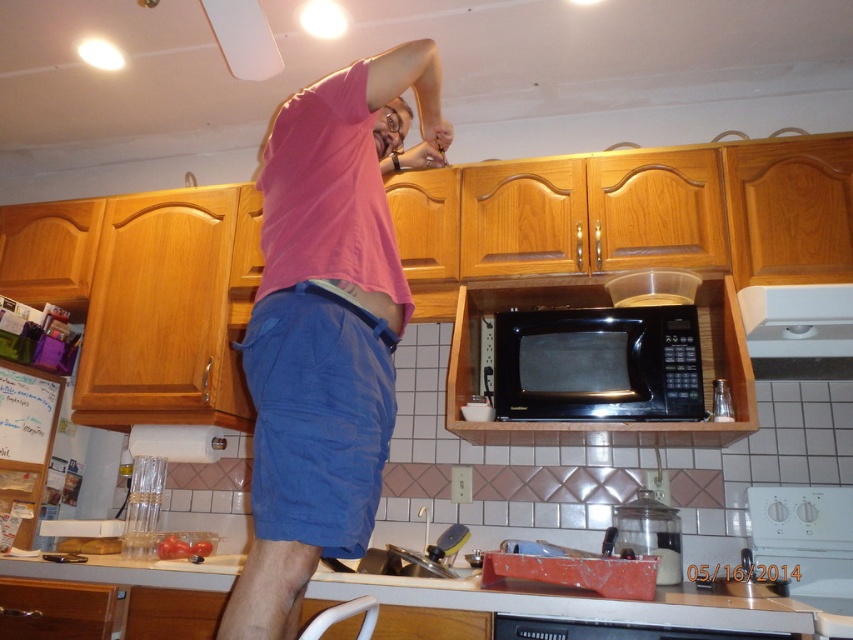
Question: Estimate the real-world distances between objects in this image. Which object is farther from the black matte microwave at center?

Choices:
 (A) pink cotton shirt at upper center
 (B) white plastic exhaust hood at upper right

Answer: (A)

Question: Observing the image, what is the correct spatial positioning of white glossy countertop at lower center in reference to white plastic exhaust hood at upper right?

Choices:
 (A) right
 (B) left

Answer: (B)

Question: Which point is farther to the camera?

Choices:
 (A) white plastic exhaust hood at upper right
 (B) black matte microwave at center
 (C) white glossy countertop at lower center
 (D) pink cotton shirt at upper center

Answer: (B)

Question: Is black matte microwave at center closer to the viewer compared to white plastic exhaust hood at upper right?

Choices:
 (A) yes
 (B) no

Answer: (B)

Question: Is white glossy countertop at lower center thinner than white plastic exhaust hood at upper right?

Choices:
 (A) no
 (B) yes

Answer: (A)

Question: Estimate the real-world distances between objects in this image. Which object is farther from the black matte microwave at center?

Choices:
 (A) white plastic exhaust hood at upper right
 (B) white glossy countertop at lower center

Answer: (B)